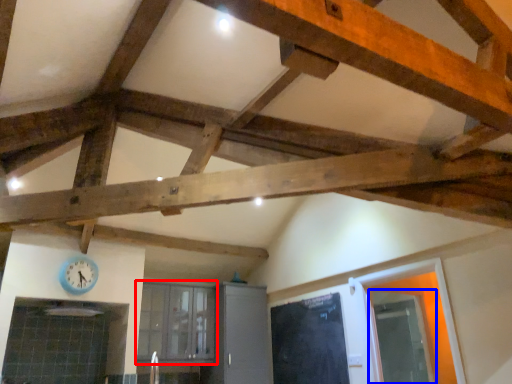
Question: Which point is closer to the camera, window (highlighted by a red box) or glass door (highlighted by a blue box)?

Choices:
 (A) window
 (B) glass door

Answer: (B)